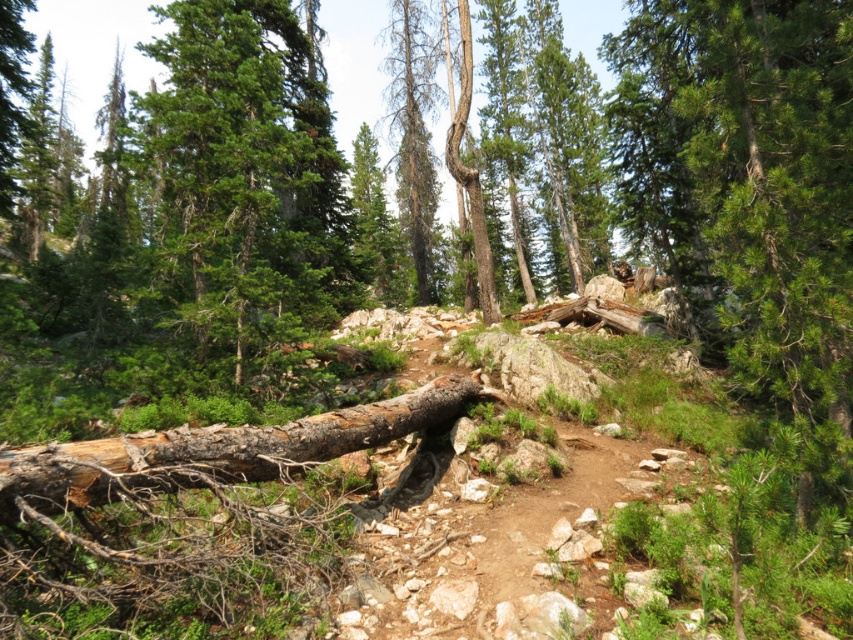
Question: Estimate the real-world distances between objects in this image. Which object is farther from the green matte tree at upper left?

Choices:
 (A) grayish-brown bark log at center
 (B) dead wood trunk at center

Answer: (B)

Question: Which is farther from the dead wood trunk at center?

Choices:
 (A) green matte tree at upper left
 (B) grayish-brown bark log at center

Answer: (B)

Question: Can you confirm if green matte tree at upper left is positioned to the right of dead wood trunk at center?

Choices:
 (A) yes
 (B) no

Answer: (A)

Question: Does grayish-brown bark log at center lie in front of dead wood trunk at center?

Choices:
 (A) yes
 (B) no

Answer: (A)

Question: Is green matte tree at upper left below dead wood trunk at center?

Choices:
 (A) yes
 (B) no

Answer: (A)

Question: Which object appears farthest from the camera in this image?

Choices:
 (A) dead wood trunk at center
 (B) green matte tree at upper left
 (C) grayish-brown bark log at center

Answer: (A)